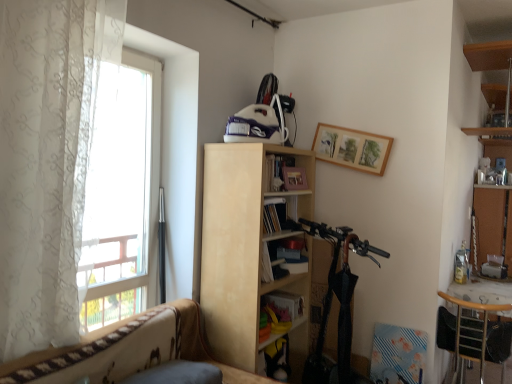
Question: In which direction should I rotate to look at hardcover book at center, which is the second book from bottom to top?

Choices:
 (A) left
 (B) right

Answer: (B)

Question: Is bare wood cabinet at right to the left of matte yellow book at center, placed as the second book when sorted from top to bottom, from the viewer's perspective?

Choices:
 (A) no
 (B) yes

Answer: (A)

Question: Considering the relative sizes of bare wood cabinet at right and matte yellow book at center, placed as the second book when sorted from top to bottom, in the image provided, is bare wood cabinet at right smaller than matte yellow book at center, placed as the second book when sorted from top to bottom,?

Choices:
 (A) yes
 (B) no

Answer: (B)

Question: Considering the relative sizes of bare wood cabinet at right and matte yellow book at center, positioned as the first book in bottom-to-top order, in the image provided, is bare wood cabinet at right thinner than matte yellow book at center, positioned as the first book in bottom-to-top order,?

Choices:
 (A) yes
 (B) no

Answer: (B)

Question: Is bare wood cabinet at right to the right of matte yellow book at center, positioned as the first book in bottom-to-top order, from the viewer's perspective?

Choices:
 (A) no
 (B) yes

Answer: (B)

Question: Is the depth of bare wood cabinet at right greater than that of matte yellow book at center, placed as the second book when sorted from top to bottom?

Choices:
 (A) no
 (B) yes

Answer: (B)

Question: From the image's perspective, does bare wood cabinet at right appear lower than matte yellow book at center, positioned as the first book in bottom-to-top order?

Choices:
 (A) no
 (B) yes

Answer: (A)

Question: Considering the relative sizes of wooden picture frame at upper center and wooden chair at lower right in the image provided, is wooden picture frame at upper center shorter than wooden chair at lower right?

Choices:
 (A) no
 (B) yes

Answer: (B)

Question: Considering the relative sizes of wooden picture frame at upper center and wooden chair at lower right in the image provided, is wooden picture frame at upper center taller than wooden chair at lower right?

Choices:
 (A) yes
 (B) no

Answer: (B)

Question: From a real-world perspective, is wooden picture frame at upper center over wooden chair at lower right?

Choices:
 (A) yes
 (B) no

Answer: (A)

Question: Can you confirm if wooden picture frame at upper center is wider than wooden chair at lower right?

Choices:
 (A) no
 (B) yes

Answer: (A)

Question: Is wooden picture frame at upper center further to camera compared to wooden chair at lower right?

Choices:
 (A) yes
 (B) no

Answer: (A)

Question: Is wooden picture frame at upper center placed right next to wooden chair at lower right?

Choices:
 (A) no
 (B) yes

Answer: (A)

Question: Is wooden chair at lower right shorter than hardcover book at center, the 1th book in the top-to-bottom sequence?

Choices:
 (A) no
 (B) yes

Answer: (A)